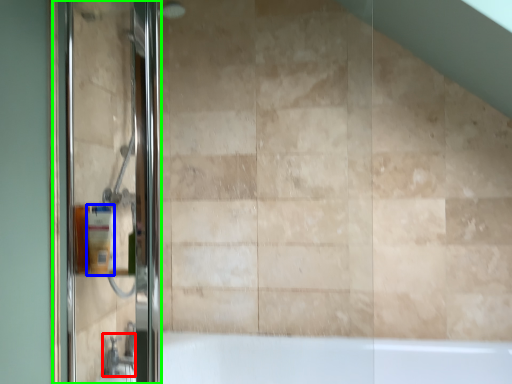
Question: Which object is the closest to the faucet (highlighted by a red box)? Choose among these: toiletry (highlighted by a blue box) or screen door (highlighted by a green box).

Choices:
 (A) toiletry
 (B) screen door

Answer: (A)